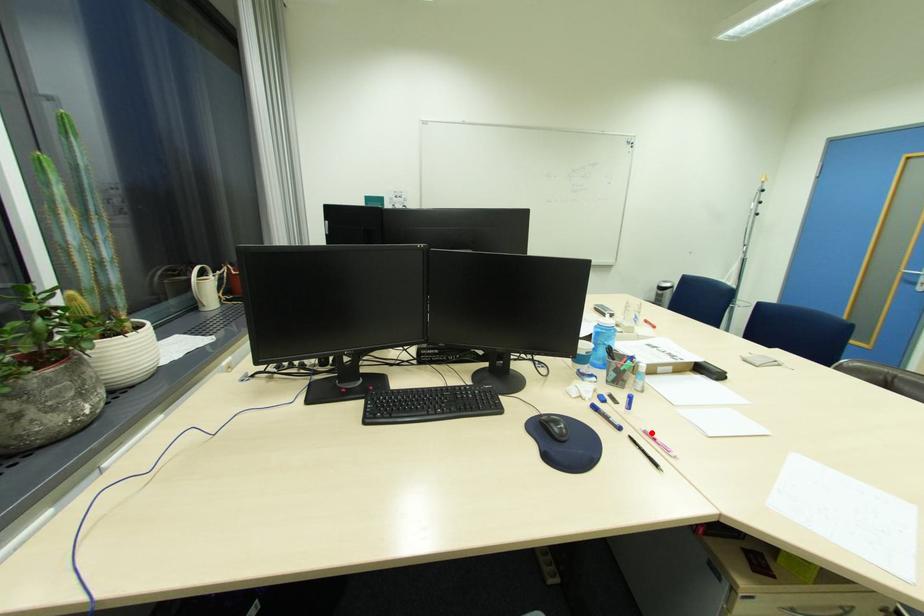
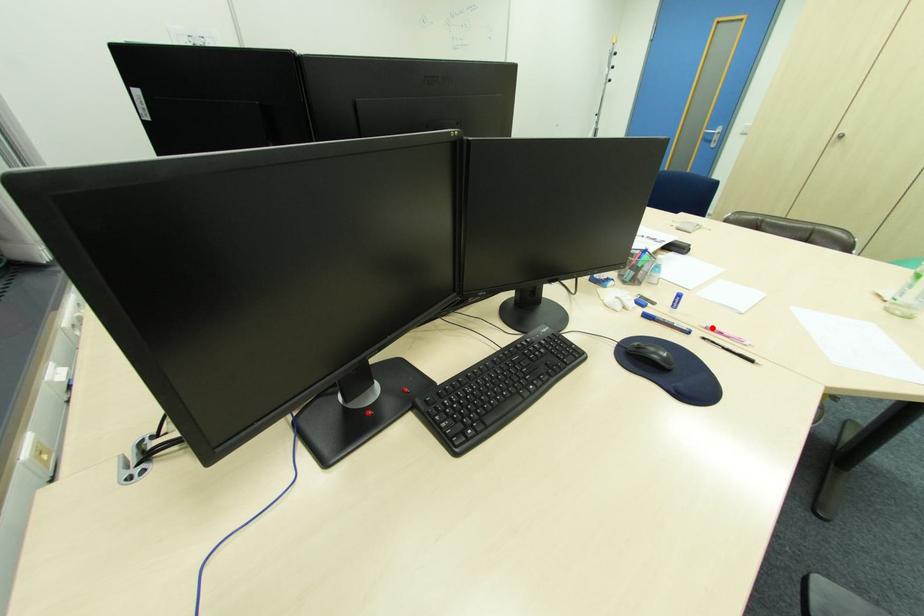
I am providing you with two images of the same scene from different viewpoints. A red point is marked on the first image and another point is marked on the second image. Are the points marked in image1 and image2 representing the same 3D position?

Yes